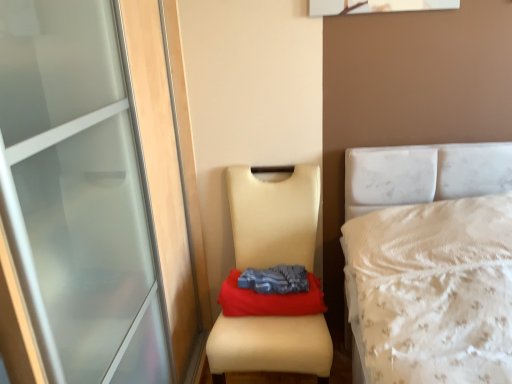
The width and height of the screenshot is (512, 384). What do you see at coordinates (275, 279) in the screenshot?
I see `blue fabric at center` at bounding box center [275, 279].

This screenshot has height=384, width=512. Identify the location of blue fabric at center. click(275, 279).

Locate an element on the screen. Image resolution: width=512 pixels, height=384 pixels. beige leather chair at center is located at coordinates (274, 217).

Is blue fabric at center outside of beige leather chair at center?

No, blue fabric at center is inside or overlapping with beige leather chair at center.

Consider the image. Considering the relative positions of blue fabric at center and beige leather chair at center in the image provided, is blue fabric at center to the left or to the right of beige leather chair at center?

blue fabric at center is to the right of beige leather chair at center.

What's the angular difference between blue fabric at center and beige leather chair at center's facing directions?

0.449 degrees.

Who is taller, blue fabric at center or beige leather chair at center?

Standing taller between the two is beige leather chair at center.

Is the depth of blue fabric at center less than that of beige leather chair at center?

No, blue fabric at center is further to the viewer.

Based on the photo, is blue fabric at center inside the boundaries of beige leather chair at center, or outside?

blue fabric at center is located inside beige leather chair at center.

Is point (283, 273) in front of point (247, 355)?

That is False.

Can you confirm if blue fabric at center is positioned to the right of blue fabric at center?

Correct, you'll find blue fabric at center to the right of blue fabric at center.

From the image's perspective, is blue fabric at center below blue fabric at center?

Yes, from the image's perspective, blue fabric at center is below blue fabric at center.

Does point (263, 313) come behind point (306, 278)?

That is False.

Is blue fabric at center with blue fabric at center?

Yes, blue fabric at center and blue fabric at center clearly make contact.

Which object is closer to the camera, beige leather chair at center or blue fabric at center?

Positioned in front is beige leather chair at center.

Is beige leather chair at center wider than blue fabric at center?

Correct, the width of beige leather chair at center exceeds that of blue fabric at center.

How far apart are beige leather chair at center and blue fabric at center?

beige leather chair at center is 21.98 centimeters away from blue fabric at center.

Which of these two, beige leather chair at center or blue fabric at center, stands taller?

With more height is beige leather chair at center.

Who is taller, beige leather chair at center or blue fabric at center?

beige leather chair at center is taller.

Is beige leather chair at center not inside blue fabric at center?

That's correct, beige leather chair at center is outside of blue fabric at center.

Is beige leather chair at center bigger than blue fabric at center?

Indeed, beige leather chair at center has a larger size compared to blue fabric at center.

Is blue fabric at center not inside blue fabric at center?

Indeed, blue fabric at center is completely outside blue fabric at center.

Is blue fabric at center at the left side of blue fabric at center?

Yes, blue fabric at center is to the left of blue fabric at center.

In terms of size, does blue fabric at center appear bigger or smaller than blue fabric at center?

blue fabric at center is smaller than blue fabric at center.

Between blue fabric at center and blue fabric at center, which one has larger width?

blue fabric at center.

You are a GUI agent. You are given a task and a screenshot of the screen. Output one action in this format:
    pyautogui.click(x=<x>, y=<y>)
    Task: Click on the furniture on the left of blue fabric at center
    This screenshot has width=512, height=384.
    Given the screenshot: What is the action you would take?
    pyautogui.click(x=274, y=217)

The height and width of the screenshot is (384, 512). There is a beige leather chair at center. In order to click on clothing above it (from a real-world perspective) in this screenshot , I will do `click(275, 279)`.

From the image, which object appears to be nearer to blue fabric at center, blue fabric at center or beige leather chair at center?

Among the two, blue fabric at center is located nearer to blue fabric at center.

Consider the image. Which object lies nearer to the anchor point beige leather chair at center, blue fabric at center or blue fabric at center?

blue fabric at center is positioned closer to the anchor beige leather chair at center.

Estimate the real-world distances between objects in this image. Which object is closer to beige leather chair at center, blue fabric at center or blue fabric at center?

Among the two, blue fabric at center is located nearer to beige leather chair at center.

Which object lies nearer to the anchor point blue fabric at center, beige leather chair at center or blue fabric at center?

blue fabric at center lies closer to blue fabric at center than the other object.

Based on their spatial positions, is beige leather chair at center or blue fabric at center further from blue fabric at center?

Based on the image, beige leather chair at center appears to be further to blue fabric at center.

Which object lies further to the anchor point blue fabric at center, blue fabric at center or beige leather chair at center?

beige leather chair at center lies further to blue fabric at center than the other object.

Where is `clothing located between beige leather chair at center and blue fabric at center in the depth direction`? This screenshot has width=512, height=384. clothing located between beige leather chair at center and blue fabric at center in the depth direction is located at coordinates click(x=275, y=279).